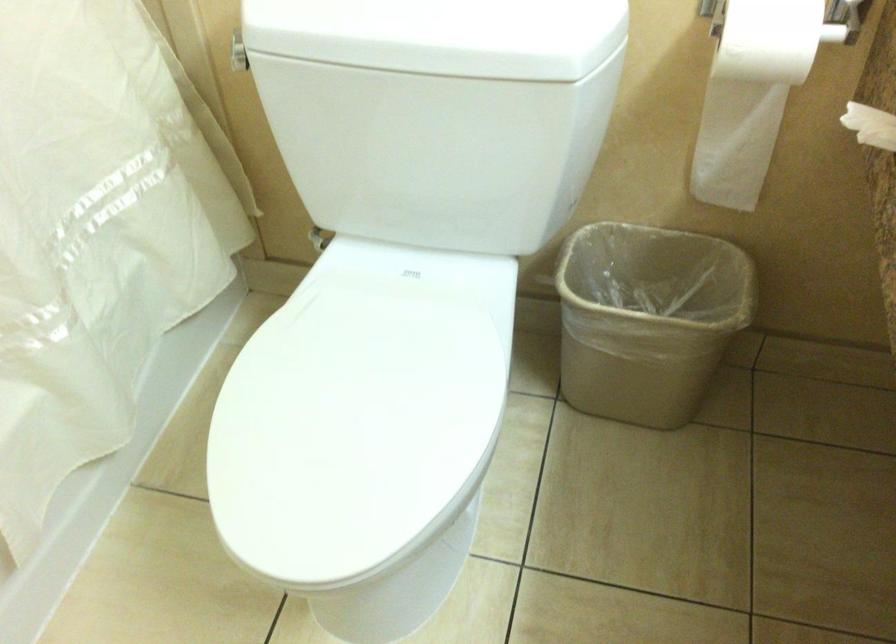
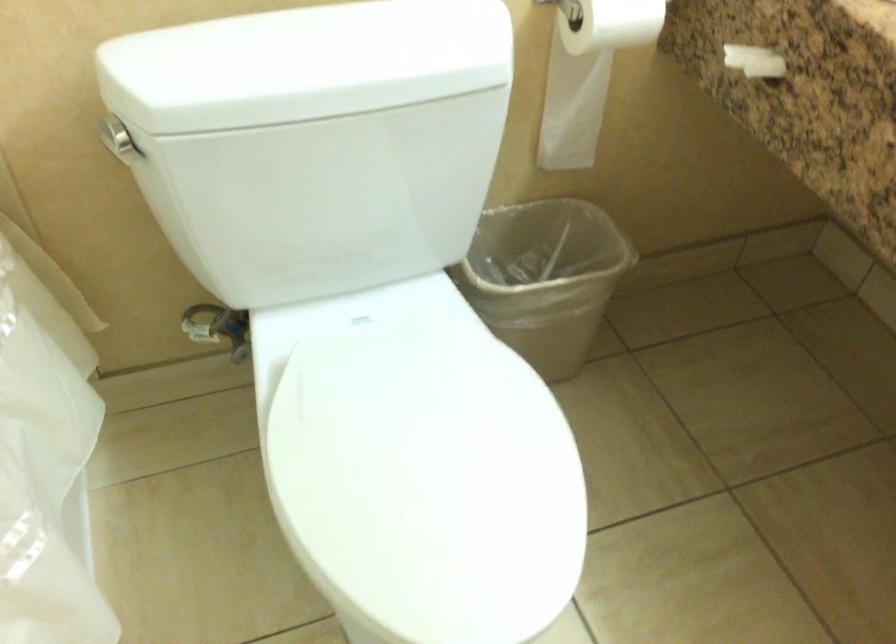
Question: The camera is either moving clockwise (left) or counter-clockwise (right) around the object. The first image is from the beginning of the video and the second image is from the end. Is the camera moving left or right when shooting the video?

Choices:
 (A) Left
 (B) Right

Answer: (A)